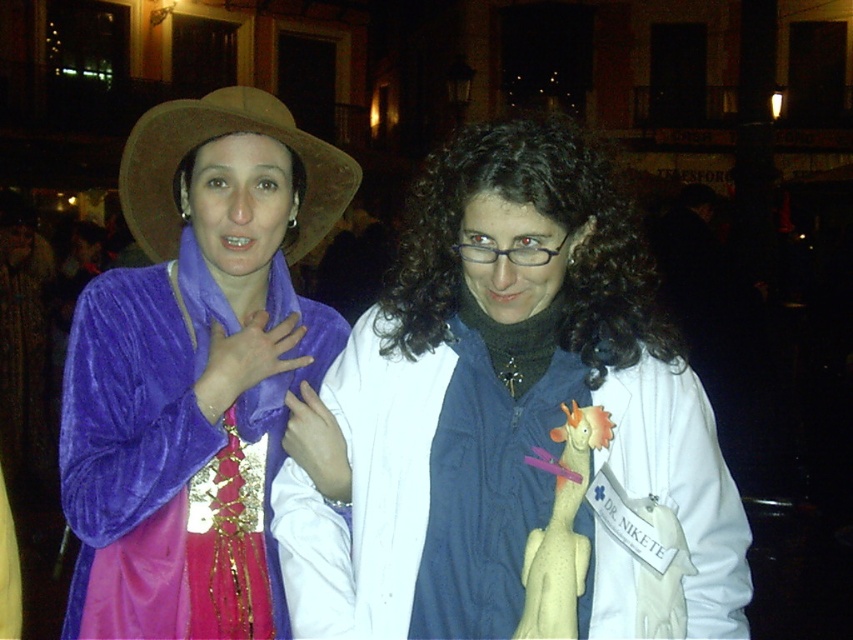
You are a photographer trying to capture a clear shot of both the velvet purple dress at left and the brown felt cowboy hat at upper left. Which object should you focus on first to ensure both are in frame?

The velvet purple dress at left is positioned on the right side of brown felt cowboy hat at upper left, so you should focus on the brown felt cowboy hat at upper left first to ensure both are in frame.

You are a photographer setting up for a night shoot in this scene. You need to ensure that the velvet purple dress at left and the brown felt cowboy hat at upper left are in focus simultaneously. Given that your camera has a depth of field that can cover 20 inches, will both subjects be in focus?

The distance between the velvet purple dress at left and the brown felt cowboy hat at upper left is 20.27 inches. Since the depth of field can only cover 20 inches, the two subjects are slightly out of the camera s depth of field range, so they cannot both be in focus at the same time.